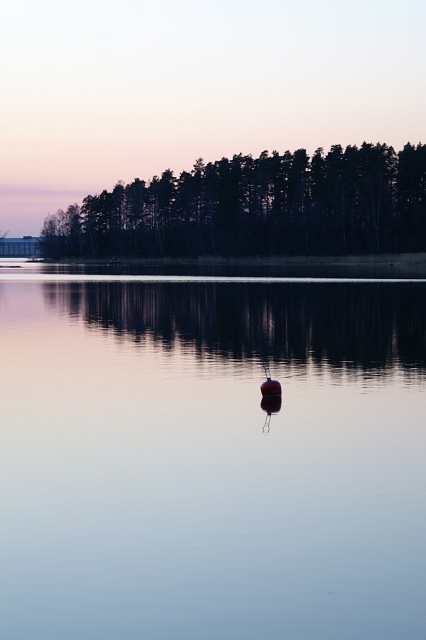
Is point (233, 444) behind point (264, 212)?

No, (233, 444) is closer to viewer.

Can you confirm if smooth water at center is positioned to the right of silhouette/black trees at upper center?

Indeed, smooth water at center is positioned on the right side of silhouette/black trees at upper center.

Image resolution: width=426 pixels, height=640 pixels. Find the location of `smooth water at center`. smooth water at center is located at coordinates (210, 456).

In order to click on smooth water at center in this screenshot , I will do `click(210, 456)`.

Who is taller, smooth water at center or smooth red buoy at center?

smooth water at center

Is smooth water at center shorter than smooth red buoy at center?

In fact, smooth water at center may be taller than smooth red buoy at center.

Between point (238, 493) and point (270, 392), which one is positioned behind?

Point (270, 392)

Identify the location of smooth water at center. (210, 456).

Is silhouette/black trees at upper center shorter than smooth red buoy at center?

No.

Which is in front, point (314, 227) or point (265, 396)?

Point (265, 396) is more forward.

What are the coordinates of `silhouette/black trees at upper center` in the screenshot? It's located at (256, 208).

Identify the location of silhouette/black trees at upper center. click(256, 208).